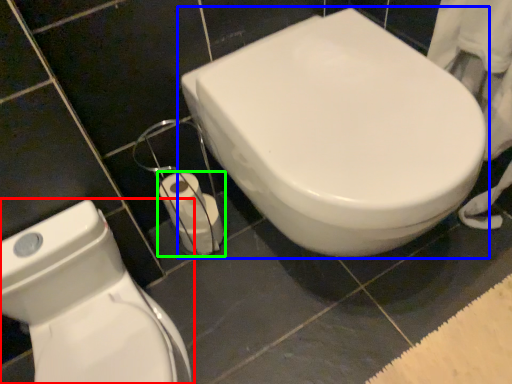
Question: Which object is positioned closest to toilet (highlighted by a red box)? Select from toilet (highlighted by a blue box) and toilet paper (highlighted by a green box).

Choices:
 (A) toilet
 (B) toilet paper

Answer: (B)